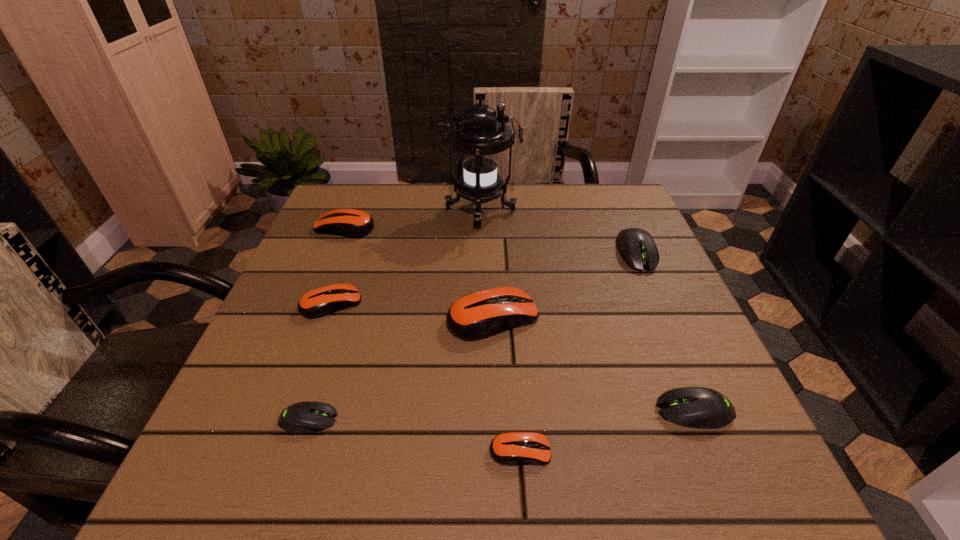
At what (x,y) coordinates should I click in order to perform the action: click on free location that satisfies the following two spatial constraints: 1. on the wheel side of the farthest gray computer mouse; 2. on the wheel side of the smallest gray computer mouse. Please return your answer as a coordinate pair (x, y). This screenshot has height=540, width=960. Looking at the image, I should click on (708, 420).